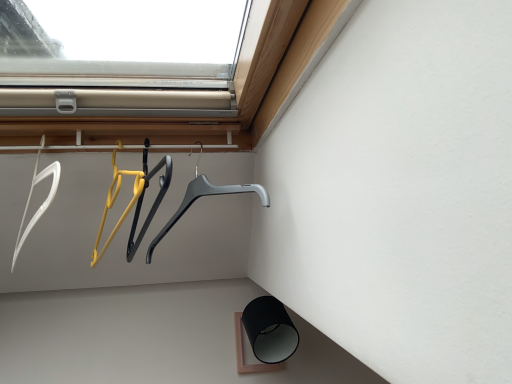
Question: From the image's perspective, is white plastic hanger at left, the first hanger in the left-to-right sequence, above gray plastic hanger at center, arranged as the 2th hanger when viewed from the left?

Choices:
 (A) yes
 (B) no

Answer: (A)

Question: Can you see white plastic hanger at left, placed as the second hanger when sorted from right to left, touching gray plastic hanger at center, arranged as the 2th hanger when viewed from the left?

Choices:
 (A) yes
 (B) no

Answer: (B)

Question: From the image's perspective, is white plastic hanger at left, the first hanger in the left-to-right sequence, beneath gray plastic hanger at center, acting as the 1th hanger starting from the right?

Choices:
 (A) yes
 (B) no

Answer: (B)

Question: Considering the relative positions of white plastic hanger at left, placed as the second hanger when sorted from right to left, and gray plastic hanger at center, acting as the 1th hanger starting from the right, in the image provided, is white plastic hanger at left, placed as the second hanger when sorted from right to left, to the right of gray plastic hanger at center, acting as the 1th hanger starting from the right, from the viewer's perspective?

Choices:
 (A) no
 (B) yes

Answer: (A)

Question: Considering the relative sizes of white plastic hanger at left, the first hanger in the left-to-right sequence, and gray plastic hanger at center, acting as the 1th hanger starting from the right, in the image provided, is white plastic hanger at left, the first hanger in the left-to-right sequence, smaller than gray plastic hanger at center, acting as the 1th hanger starting from the right,?

Choices:
 (A) yes
 (B) no

Answer: (A)

Question: Is white plastic hanger at left, placed as the second hanger when sorted from right to left, behind gray plastic hanger at center, arranged as the 2th hanger when viewed from the left?

Choices:
 (A) no
 (B) yes

Answer: (A)

Question: Is gray plastic hanger at center, acting as the 1th hanger starting from the right, oriented away from white plastic hanger at left, the first hanger in the left-to-right sequence?

Choices:
 (A) no
 (B) yes

Answer: (A)

Question: From a real-world perspective, is gray plastic hanger at center, acting as the 1th hanger starting from the right, below white plastic hanger at left, placed as the second hanger when sorted from right to left?

Choices:
 (A) yes
 (B) no

Answer: (A)

Question: Considering the relative sizes of gray plastic hanger at center, acting as the 1th hanger starting from the right, and white plastic hanger at left, placed as the second hanger when sorted from right to left, in the image provided, is gray plastic hanger at center, acting as the 1th hanger starting from the right, bigger than white plastic hanger at left, placed as the second hanger when sorted from right to left,?

Choices:
 (A) yes
 (B) no

Answer: (A)

Question: Is gray plastic hanger at center, arranged as the 2th hanger when viewed from the left, aimed at white plastic hanger at left, placed as the second hanger when sorted from right to left?

Choices:
 (A) yes
 (B) no

Answer: (B)

Question: Considering the relative positions of gray plastic hanger at center, arranged as the 2th hanger when viewed from the left, and white plastic hanger at left, placed as the second hanger when sorted from right to left, in the image provided, is gray plastic hanger at center, arranged as the 2th hanger when viewed from the left, to the right of white plastic hanger at left, placed as the second hanger when sorted from right to left, from the viewer's perspective?

Choices:
 (A) yes
 (B) no

Answer: (A)

Question: Would you say gray plastic hanger at center, arranged as the 2th hanger when viewed from the left, is outside white plastic hanger at left, placed as the second hanger when sorted from right to left?

Choices:
 (A) yes
 (B) no

Answer: (A)

Question: Relative to gray plastic hanger at center, acting as the 1th hanger starting from the right, is white plastic hanger at left, the first hanger in the left-to-right sequence, in front or behind?

Choices:
 (A) front
 (B) behind

Answer: (A)